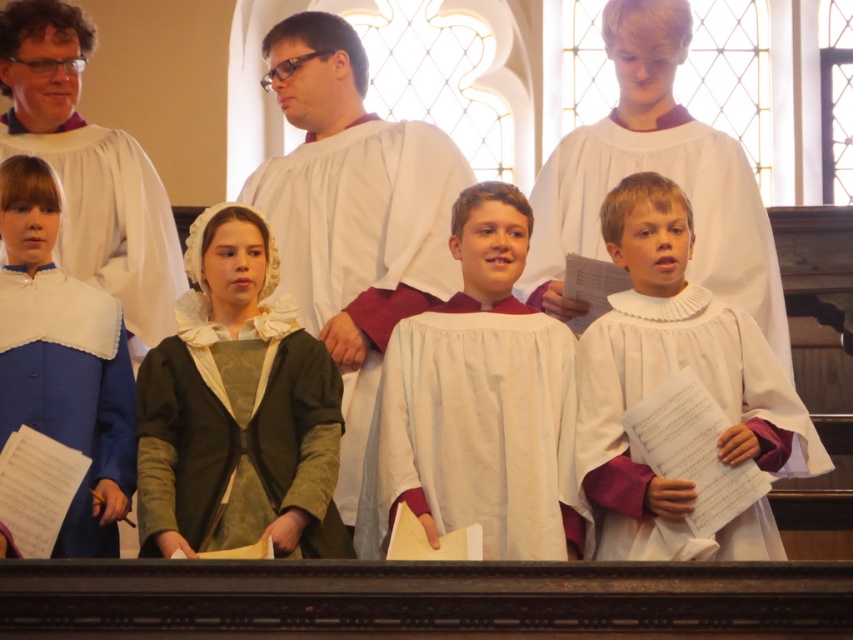
You are an interior designer assessing the spatial arrangement of the church choir. You notice the green textured fabric robe at center and the blue satin robe at lower left. Which robe is positioned lower in the image?

The green textured fabric robe at center is positioned below the blue satin robe at lower left, so it is lower in the image.

You are organizing a choir performance and need to arrange the green textured fabric robe at center and the blue satin robe at lower left on a rack. Which robe requires a wider space on the rack?

→ The green textured fabric robe at center requires a wider space on the rack because its width is larger than the blue satin robe at lower left.